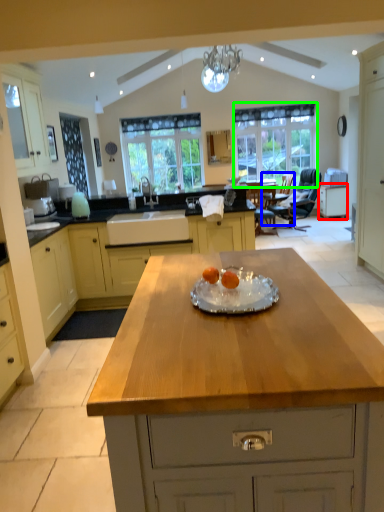
Question: Which is farther away from cabinetry (highlighted by a red box)? armchair (highlighted by a blue box) or window (highlighted by a green box)?

Choices:
 (A) armchair
 (B) window

Answer: (B)